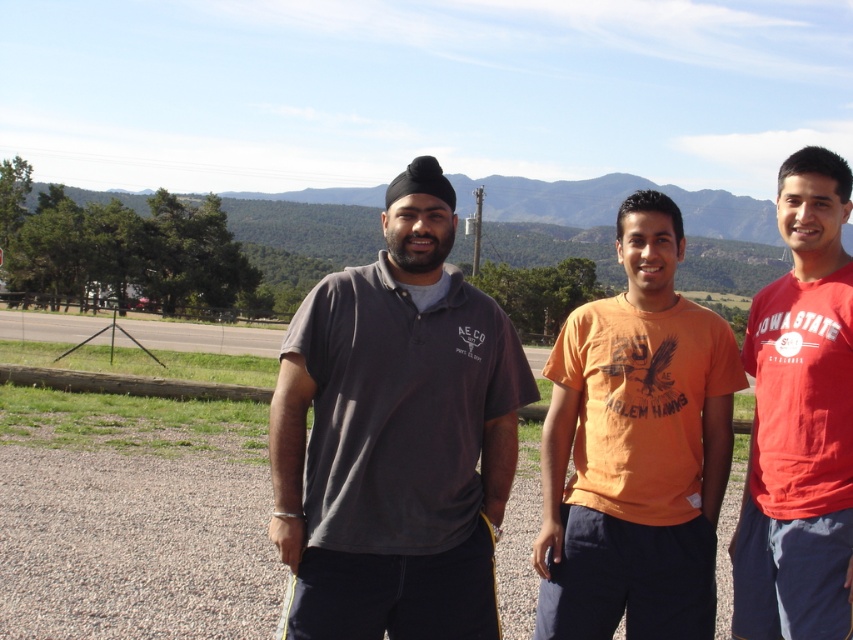
Question: Can you confirm if dark gray polo shirt at center is bigger than matte red t-shirt at right?

Choices:
 (A) no
 (B) yes

Answer: (A)

Question: Estimate the real-world distances between objects in this image. Which object is farther from the dark gray polo shirt at center?

Choices:
 (A) matte red t-shirt at right
 (B) orange cotton t-shirt at center

Answer: (A)

Question: Is dark gray polo shirt at center further to the viewer compared to orange cotton t-shirt at center?

Choices:
 (A) no
 (B) yes

Answer: (A)

Question: Based on their relative distances, which object is nearer to the matte red t-shirt at right?

Choices:
 (A) dark gray polo shirt at center
 (B) orange cotton t-shirt at center

Answer: (B)

Question: Which point appears farthest from the camera in this image?

Choices:
 (A) (810, 234)
 (B) (440, 604)

Answer: (A)

Question: Does orange cotton t-shirt at center have a greater width compared to matte red t-shirt at right?

Choices:
 (A) no
 (B) yes

Answer: (B)